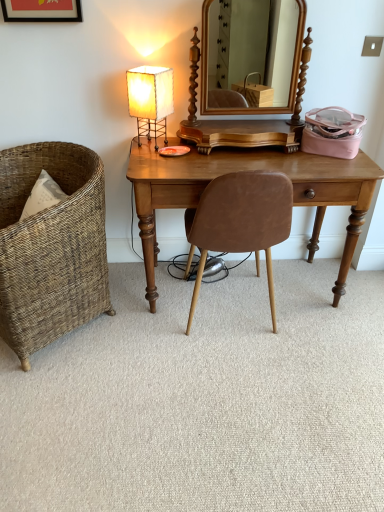
In order to click on vacant area that is situated to the right of brown leather chair at center, placed as the second chair when sorted from left to right in this screenshot , I will do `click(335, 333)`.